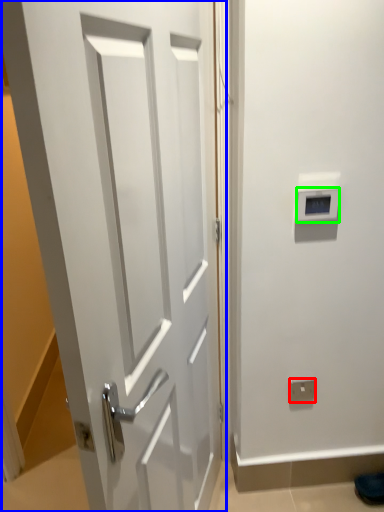
Question: Which object is positioned farthest from electric outlet (highlighted by a red box)? Select from door (highlighted by a blue box) and thermostat (highlighted by a green box).

Choices:
 (A) door
 (B) thermostat

Answer: (A)